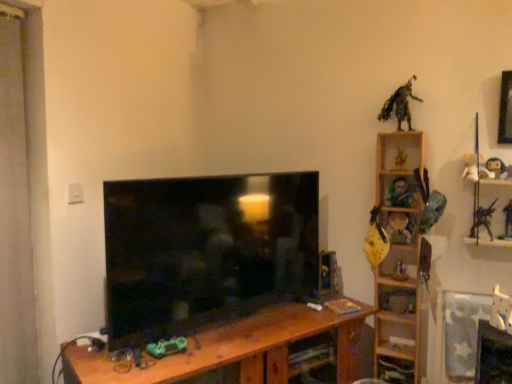
Question: Is plush white doll at upper right, placed as the tenth toy when sorted from left to right, beside metallic silver toy at right, which is counted as the 1th toy, starting from the right?

Choices:
 (A) no
 (B) yes

Answer: (A)

Question: Does plush white doll at upper right, placed as the tenth toy when sorted from left to right, have a smaller size compared to metallic silver toy at right, which is counted as the 1th toy, starting from the right?

Choices:
 (A) no
 (B) yes

Answer: (A)

Question: Does plush white doll at upper right, placed as the tenth toy when sorted from left to right, lie behind metallic silver toy at right, which is counted as the 1th toy, starting from the right?

Choices:
 (A) no
 (B) yes

Answer: (A)

Question: Can metallic silver toy at right, which is counted as the 1th toy, starting from the right, be found inside plush white doll at upper right, marked as the third toy in a right-to-left arrangement?

Choices:
 (A) yes
 (B) no

Answer: (A)

Question: Does plush white doll at upper right, placed as the tenth toy when sorted from left to right, appear on the right side of metallic silver toy at right, the twelfth toy positioned from the left?

Choices:
 (A) no
 (B) yes

Answer: (A)

Question: Considering the relative sizes of plush white doll at upper right, placed as the tenth toy when sorted from left to right, and metallic silver toy at right, which is counted as the 1th toy, starting from the right, in the image provided, is plush white doll at upper right, placed as the tenth toy when sorted from left to right, bigger than metallic silver toy at right, which is counted as the 1th toy, starting from the right,?

Choices:
 (A) no
 (B) yes

Answer: (B)

Question: Does metallic silver toy at right, which is counted as the 1th toy, starting from the right, lie behind yellow matte guitar at upper right, the ninth toy from the right?

Choices:
 (A) no
 (B) yes

Answer: (A)

Question: Is metallic silver toy at right, the twelfth toy positioned from the left, not within yellow matte guitar at upper right, the 4th toy from the left?

Choices:
 (A) yes
 (B) no

Answer: (A)

Question: Is metallic silver toy at right, which is counted as the 1th toy, starting from the right, shorter than yellow matte guitar at upper right, the 4th toy from the left?

Choices:
 (A) yes
 (B) no

Answer: (B)

Question: Is metallic silver toy at right, the twelfth toy positioned from the left, far from yellow matte guitar at upper right, the ninth toy from the right?

Choices:
 (A) no
 (B) yes

Answer: (A)

Question: Can you confirm if metallic silver toy at right, which is counted as the 1th toy, starting from the right, is positioned to the right of yellow matte guitar at upper right, the ninth toy from the right?

Choices:
 (A) yes
 (B) no

Answer: (A)

Question: Is metallic silver toy at right, the twelfth toy positioned from the left, to the left of yellow matte guitar at upper right, the ninth toy from the right, from the viewer's perspective?

Choices:
 (A) yes
 (B) no

Answer: (B)

Question: Considering the relative sizes of brown wood table at center and metallic silver toy at right, which is counted as the 1th toy, starting from the right, in the image provided, is brown wood table at center wider than metallic silver toy at right, which is counted as the 1th toy, starting from the right,?

Choices:
 (A) no
 (B) yes

Answer: (B)